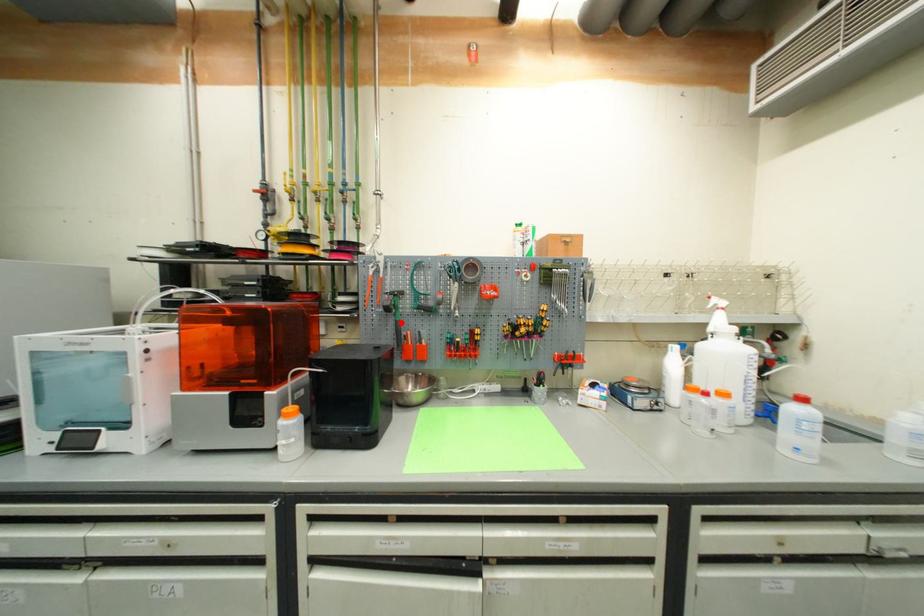
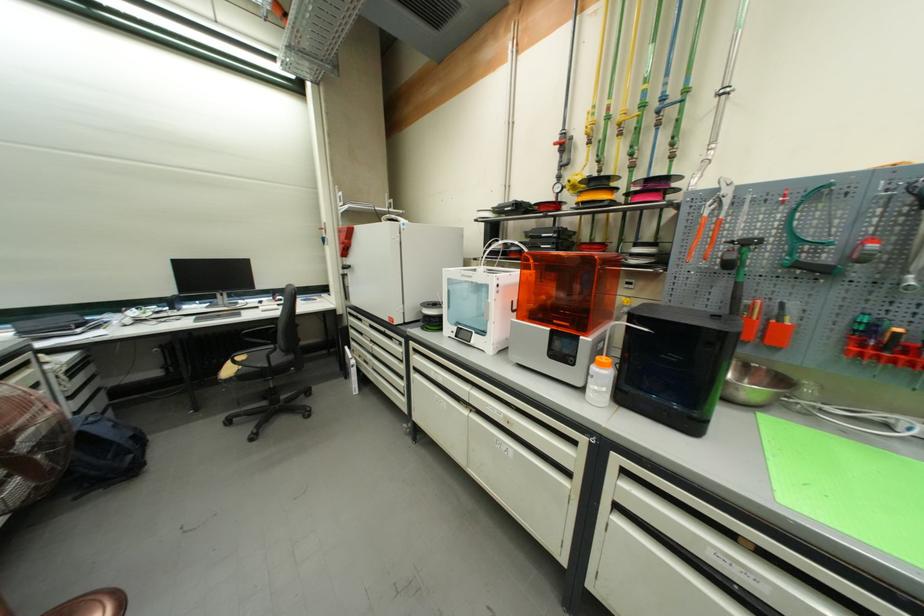
The point at the highlighted location is marked in the first image. Where is the corresponding point in the second image?

(742, 285)